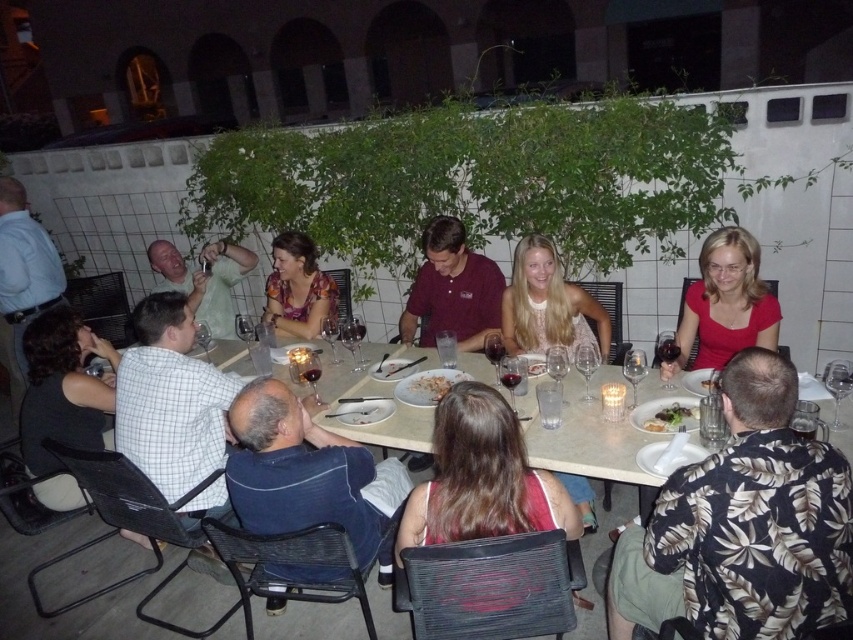
Question: Does maroon shirt at center appear under white fluffy rice at center?

Choices:
 (A) no
 (B) yes

Answer: (A)

Question: Is matte pink tank top at center closer to camera compared to matte floral dress at center?

Choices:
 (A) no
 (B) yes

Answer: (B)

Question: Can you confirm if floral print shirt at lower right is smaller than matte floral dress at center?

Choices:
 (A) no
 (B) yes

Answer: (A)

Question: Which object is positioned closest to the matte floral dress at center?

Choices:
 (A) matte pink tank top at center
 (B) maroon shirt at center
 (C) white glossy plate at lower right

Answer: (B)

Question: Which object is positioned farthest from the matte floral dress at center?

Choices:
 (A) dark blue shirt at lower center
 (B) floral print shirt at lower right
 (C) matte red shirt at upper right

Answer: (B)

Question: Which object is the farthest from the white fluffy rice at center?

Choices:
 (A) white glossy table at center
 (B) white porcelain plate at center
 (C) floral print shirt at lower right

Answer: (C)